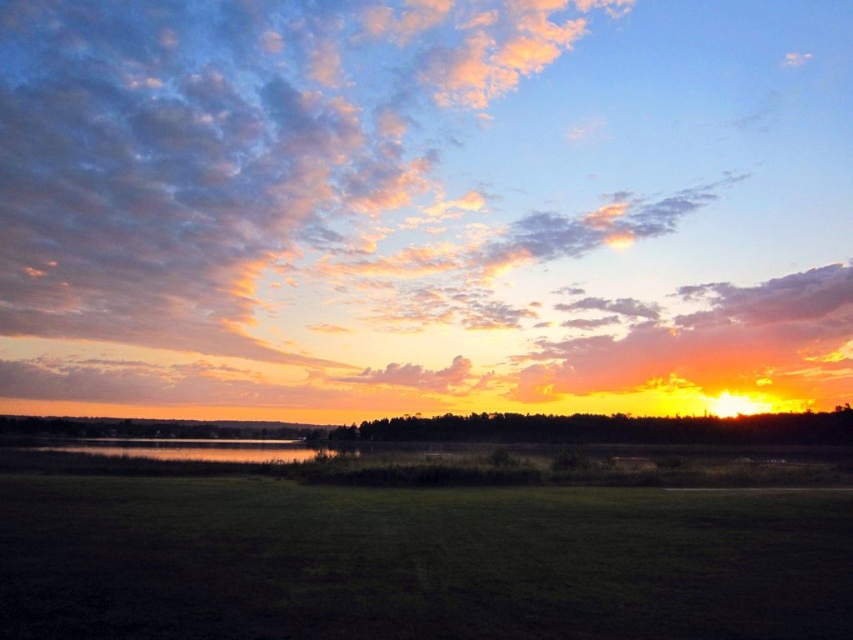
Between cloudy sky at upper center and green grass at lower center, which one has more height?

Standing taller between the two is cloudy sky at upper center.

Does cloudy sky at upper center appear on the left side of green grass at lower center?

Yes, cloudy sky at upper center is to the left of green grass at lower center.

In the scene shown: Who is more forward, (106, 344) or (136, 547)?

Point (136, 547) is more forward.

What are the coordinates of `cloudy sky at upper center` in the screenshot? It's located at (425, 204).

Can you confirm if green grass at lower center is bigger than glossy reflective water at center?

Incorrect, green grass at lower center is not larger than glossy reflective water at center.

What do you see at coordinates (416, 561) in the screenshot? I see `green grass at lower center` at bounding box center [416, 561].

Who is more forward, (485, 492) or (160, 458)?

Positioned in front is point (485, 492).

Locate an element on the screen. green grass at lower center is located at coordinates (416, 561).

Is cloudy sky at upper center wider than glossy reflective water at center?

Yes, cloudy sky at upper center is wider than glossy reflective water at center.

Is cloudy sky at upper center in front of glossy reflective water at center?

No, cloudy sky at upper center is behind glossy reflective water at center.

Where is `cloudy sky at upper center`? cloudy sky at upper center is located at coordinates (425, 204).